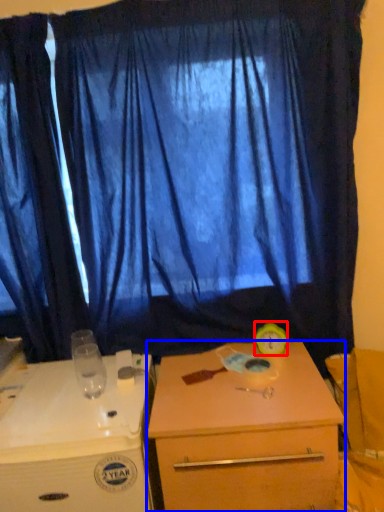
Question: Which object is further to the camera taking this photo, alarm clock (highlighted by a red box) or desk (highlighted by a blue box)?

Choices:
 (A) alarm clock
 (B) desk

Answer: (A)